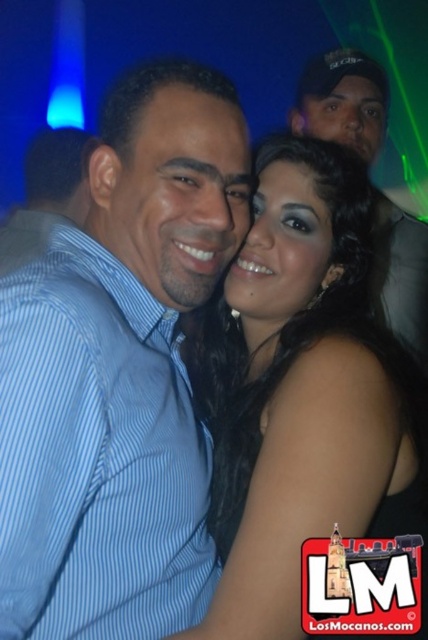
Question: Which of the following is the closest to the observer?

Choices:
 (A) black satin dress at center
 (B) black cap at upper right

Answer: (A)

Question: Does black cap at upper right appear on the left side of blue striped shirt at left?

Choices:
 (A) no
 (B) yes

Answer: (A)

Question: Estimate the real-world distances between objects in this image. Which object is farther from the black cap at upper right?

Choices:
 (A) blue striped shirt at left
 (B) blue striped shirt at center
 (C) black satin dress at center

Answer: (B)

Question: Can you confirm if black cap at upper right is wider than blue striped shirt at left?

Choices:
 (A) no
 (B) yes

Answer: (A)

Question: Which of these objects is positioned farthest from the black cap at upper right?

Choices:
 (A) blue striped shirt at left
 (B) black satin dress at center
 (C) blue striped shirt at center

Answer: (C)

Question: Is black cap at upper right thinner than blue striped shirt at left?

Choices:
 (A) yes
 (B) no

Answer: (A)